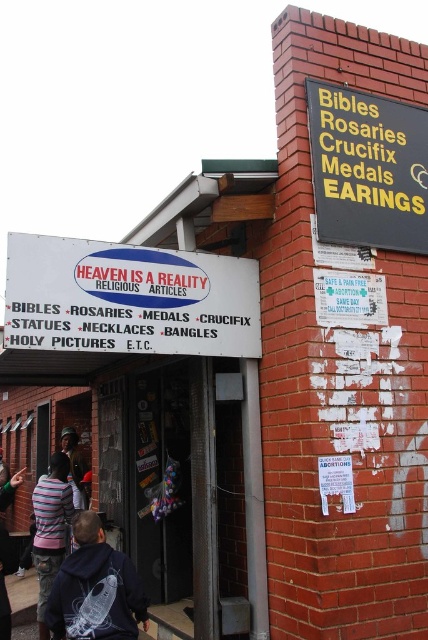
Between dark blue hoodie at lower left and striped fabric jacket at lower left, which one has less height?

With less height is dark blue hoodie at lower left.

Is dark blue hoodie at lower left above striped fabric jacket at lower left?

Yes, dark blue hoodie at lower left is above striped fabric jacket at lower left.

Which is behind, point (89, 512) or point (47, 534)?

The point (47, 534) is more distant.

Locate an element on the screen. dark blue hoodie at lower left is located at coordinates (95, 588).

Between striped fabric jacket at lower left and white paper sign at center, which one appears on the left side from the viewer's perspective?

From the viewer's perspective, striped fabric jacket at lower left appears more on the left side.

At what (x,y) coordinates should I click in order to perform the action: click on striped fabric jacket at lower left. Please return your answer as a coordinate pair (x, y). The width and height of the screenshot is (428, 640). Looking at the image, I should click on (50, 529).

Does white plastic signboard at center lie in front of yellow plastic sign at upper right?

Yes, it is in front of yellow plastic sign at upper right.

Is point (8, 298) behind point (386, 163)?

No, it is not.

Find the location of a particular element. white plastic signboard at center is located at coordinates (128, 298).